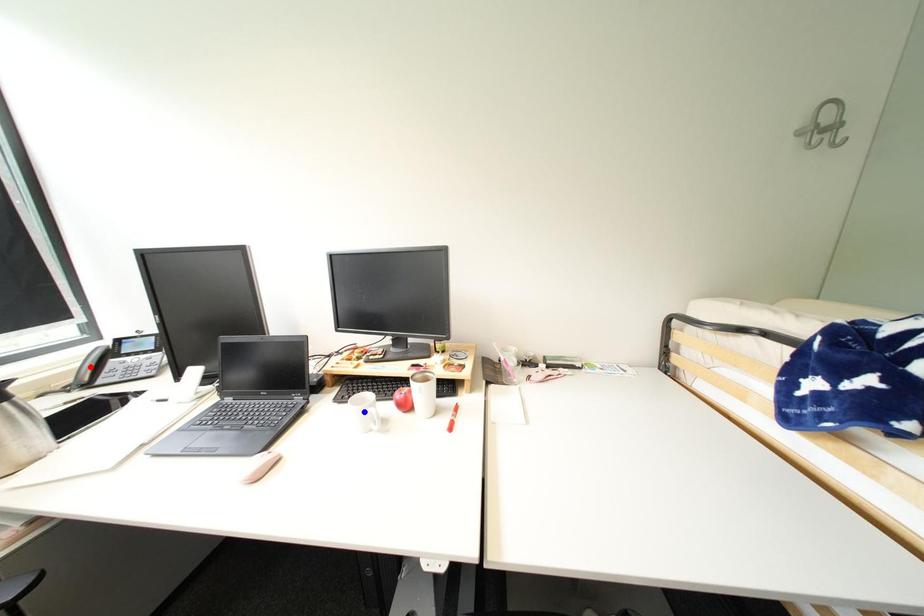
Question: Two points are marked on the image. Which point is closer to the camera?

Choices:
 (A) Blue point is closer.
 (B) Red point is closer.

Answer: (B)